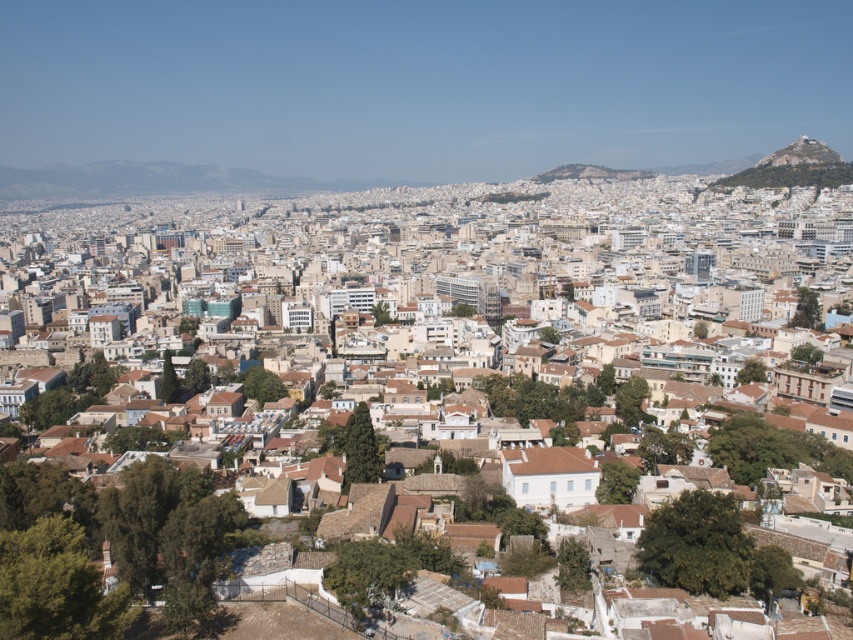
Is white textured buildings at center above rustic stone peak at upper right?

No, white textured buildings at center is not above rustic stone peak at upper right.

Is white textured buildings at center below rustic stone peak at upper right?

Yes.

Is point (225, 288) positioned after point (770, 152)?

No, it is in front of (770, 152).

This screenshot has height=640, width=853. Find the location of `white textured buildings at center`. white textured buildings at center is located at coordinates [468, 294].